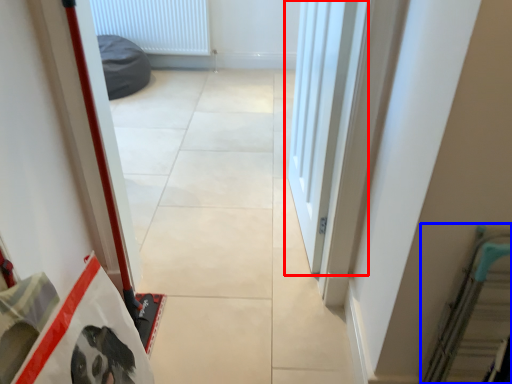
Question: Which object is closer to the camera taking this photo, door (highlighted by a red box) or escalator (highlighted by a blue box)?

Choices:
 (A) door
 (B) escalator

Answer: (B)